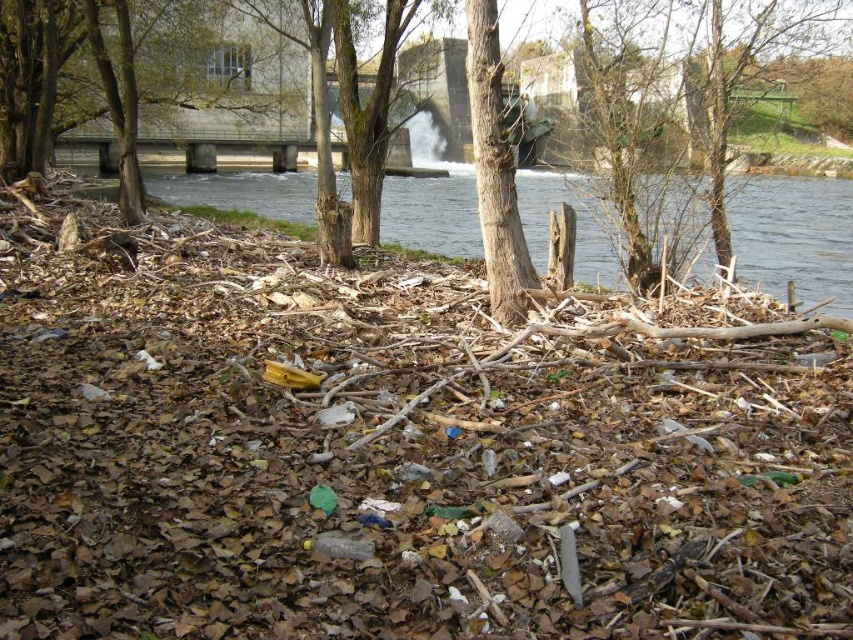
Which is above, brown wood tree at center or brown rough bark tree at center?

brown wood tree at center

Is point (773, 285) behind point (479, 109)?

Yes, it is.

Where is `brown wood tree at center`? Image resolution: width=853 pixels, height=640 pixels. brown wood tree at center is located at coordinates (796, 236).

Which is behind, point (537, 237) or point (445, 218)?

Point (445, 218)

Is clear water at center above brown wood tree at center?

No, clear water at center is not above brown wood tree at center.

Which is in front, point (412, 193) or point (811, 204)?

Positioned in front is point (811, 204).

Where is `clear water at center`? clear water at center is located at coordinates (795, 237).

Between clear water at center and brown rough bark tree at center, which one is positioned higher?

clear water at center is higher up.

Which of these two, clear water at center or brown rough bark tree at center, stands taller?

clear water at center

Is point (280, 211) in front of point (486, 52)?

That is False.

The height and width of the screenshot is (640, 853). In order to click on clear water at center in this screenshot , I will do `click(795, 237)`.